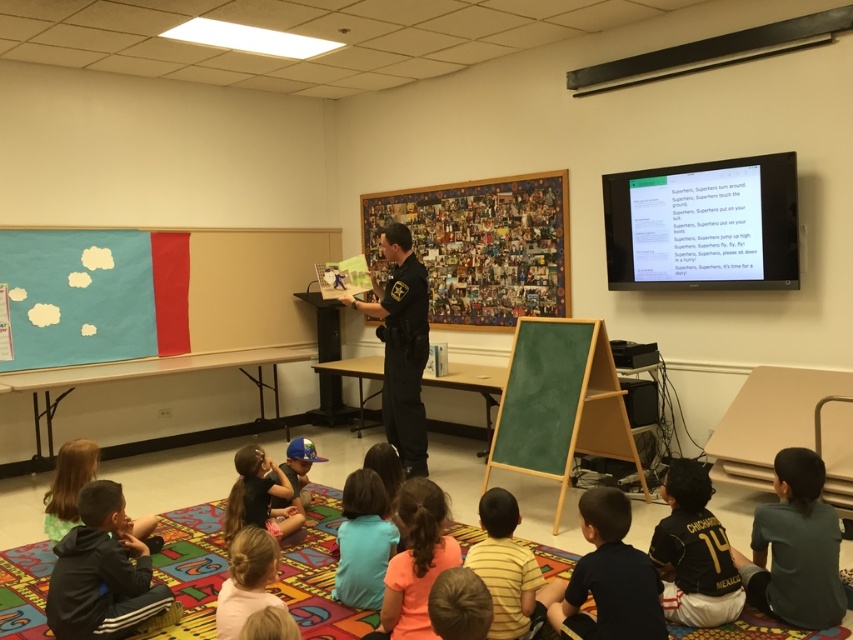
You are a student sitting in the classroom and you see the blue fabric cap at center and the brown fuzzy hat at lower center. Which hat is closer to the ceiling?

The brown fuzzy hat at lower center is closer to the ceiling because the blue fabric cap at center is positioned under it.

You are a student sitting on the floor in the classroom. You notice two items in the image. One is the light brown hair at lower left and the other is the brown fuzzy hat at lower center. Which item is taller?

The light brown hair at lower left is much taller than the brown fuzzy hat at lower center.